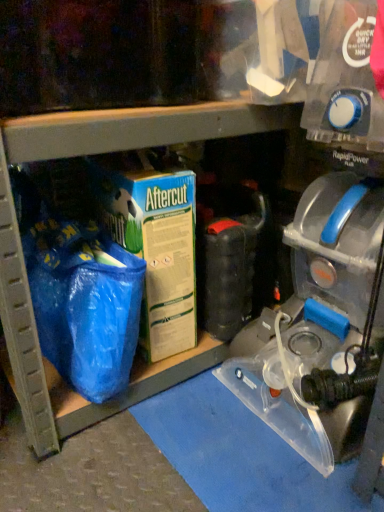
Find the location of `blue plastic bag at lower left`. blue plastic bag at lower left is located at coordinates (23, 260).

Describe the element at coordinates (23, 260) in the screenshot. Image resolution: width=384 pixels, height=512 pixels. I see `blue plastic bag at lower left` at that location.

Image resolution: width=384 pixels, height=512 pixels. Identify the location of blue plastic bag at lower left. (23, 260).